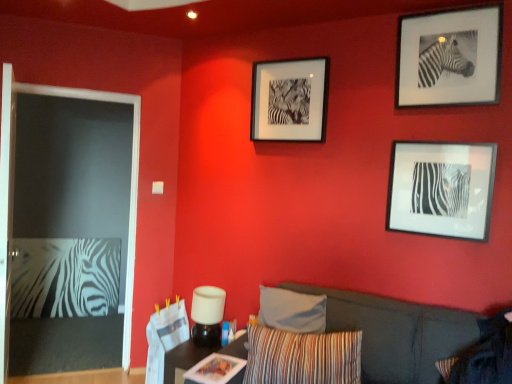
Question: In terms of height, does striped fabric pillow at lower right, the second pillow when ordered from left to right, look taller or shorter compared to black matte picture frame at center-right, acting as the 2th picture frame starting from the left?

Choices:
 (A) short
 (B) tall

Answer: (A)

Question: Considering the positions of point (440, 355) and point (479, 183), is point (440, 355) closer or farther from the camera than point (479, 183)?

Choices:
 (A) farther
 (B) closer

Answer: (B)

Question: Estimate the real-world distances between objects in this image. Which object is farther from the black matte picture frame at center-right, which ranks as the second picture frame in right-to-left order?

Choices:
 (A) dark gray fabric couch at center
 (B) striped fabric pillow at lower right, the second pillow when ordered from left to right
 (C) black matte picture frame at upper center, acting as the third picture frame starting from the right
 (D) black matte picture frame at upper right, the third picture frame viewed from the left
 (E) white matte lamp at center

Answer: (E)

Question: Based on their relative distances, which object is farther from the striped fabric pillow at lower right, the second pillow when ordered from left to right?

Choices:
 (A) black matte picture frame at center-right, acting as the 2th picture frame starting from the left
 (B) wooden table at lower center
 (C) striped fabric pillow at lower center, the second pillow from the right
 (D) black matte picture frame at upper right, arranged as the first picture frame when viewed from the right
 (E) white matte lamp at center

Answer: (D)